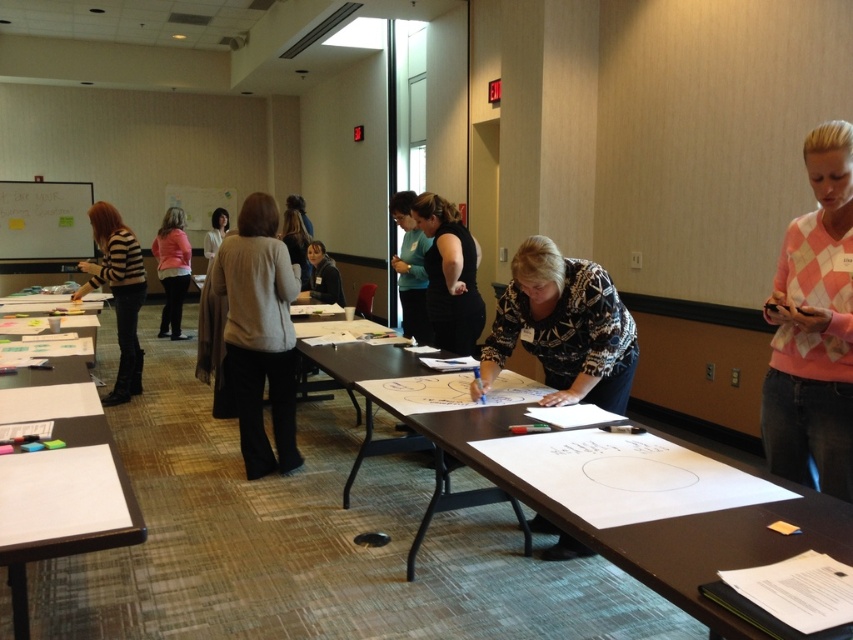
Question: Does smooth brown table at center appear over light pink sweater at center?

Choices:
 (A) yes
 (B) no

Answer: (B)

Question: Estimate the real-world distances between objects in this image. Which object is closer to the white paper at lower left?

Choices:
 (A) black matte dress at center
 (B) patterned sweater at center

Answer: (B)

Question: Is black matte dress at center behind striped sweater at left?

Choices:
 (A) yes
 (B) no

Answer: (B)

Question: Does light gray sweater at center have a lesser width compared to light pink sweater at center?

Choices:
 (A) no
 (B) yes

Answer: (B)

Question: Which point is farther to the camera?

Choices:
 (A) black matte dress at center
 (B) light gray sweater at center
 (C) matte white blouse at center
 (D) striped sweater at left

Answer: (C)

Question: Which of these objects is positioned farthest from the black matte dress at center?

Choices:
 (A) patterned sweater at center
 (B) white paper at lower left
 (C) light gray sweater at center
 (D) smooth brown table at center

Answer: (B)